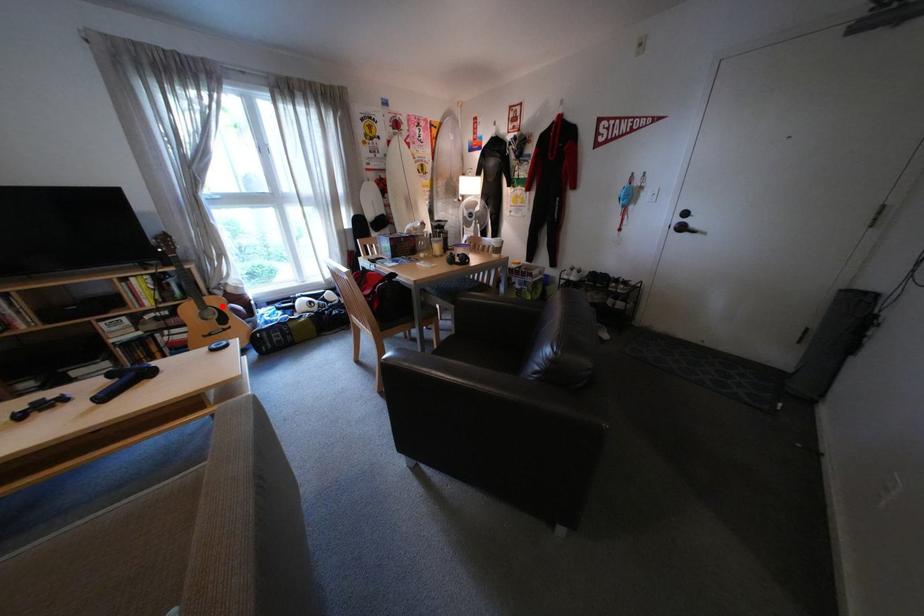
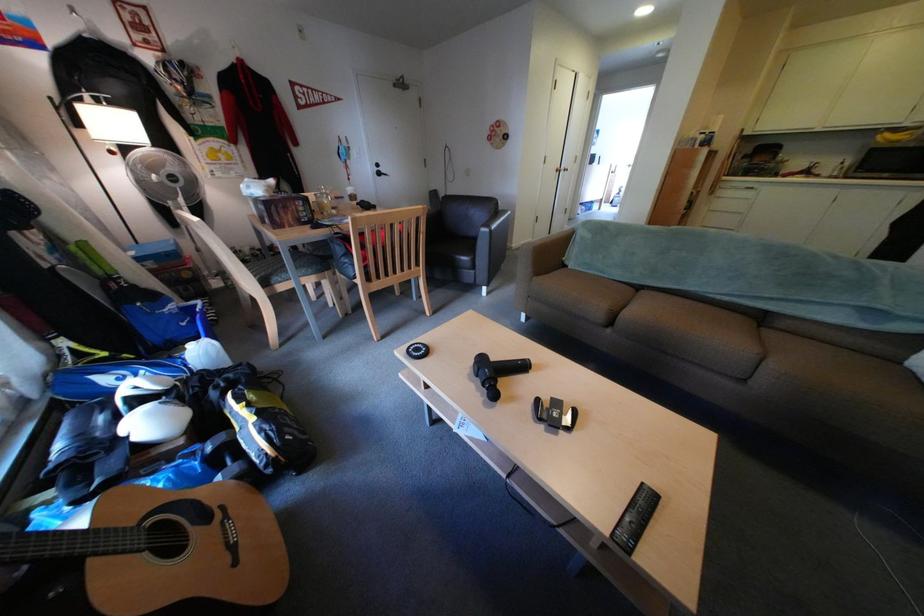
The point at the highlighted location is marked in the first image. Where is the corresponding point in the second image?

(148, 527)